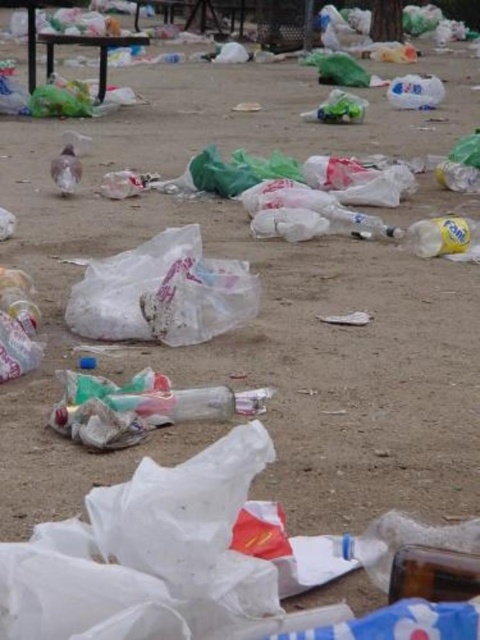
You are a researcher analyzing the plastic waste distribution in the image. You have a specific point at coordinates point (x=432, y=573). Which object in the image does this point belong to?

The point (x=432, y=573) is on the transparent plastic bottle at lower right.